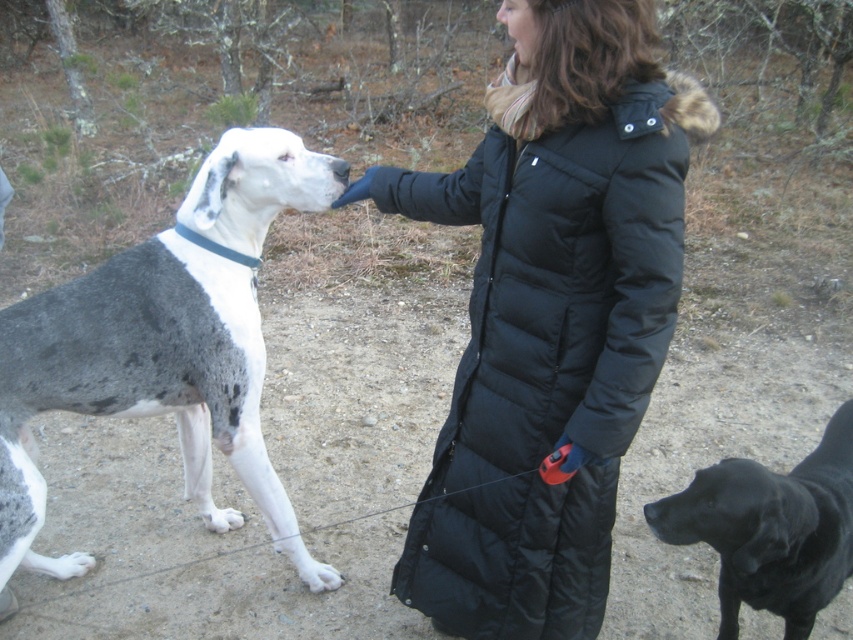
You are standing at the point labeled point (x=502, y=8) and want to move to the point labeled point (x=547, y=358). Based on the scene description, will you be moving forward or backward?

Based on the scene description, point (x=547, y=358) is behind point (x=502, y=8). Therefore, moving from point (x=502, y=8) to point (x=547, y=358) would mean moving backward.